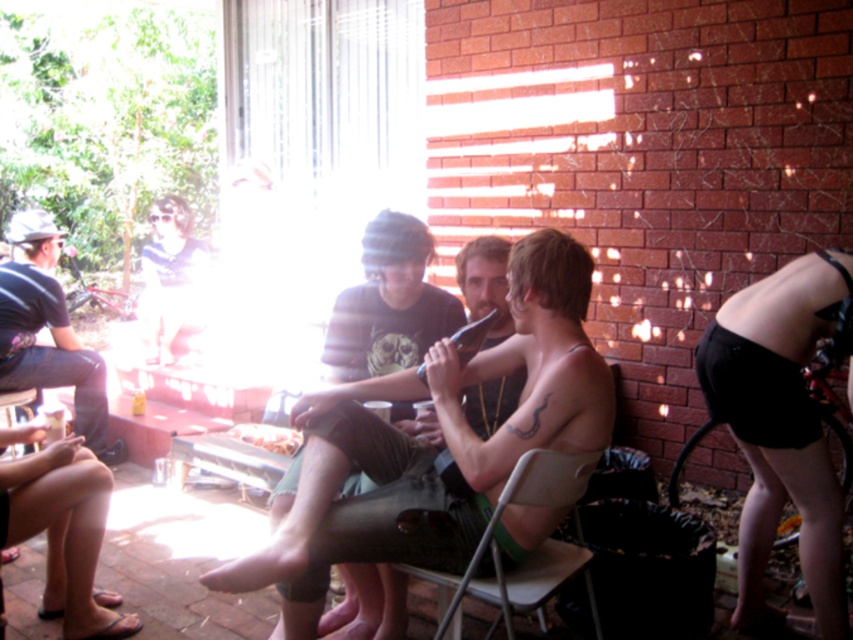
Is point (363, 522) behind point (579, 468)?

Yes, it is.

Does shiny metallic flute at center appear under white plastic chair at lower center?

Actually, shiny metallic flute at center is above white plastic chair at lower center.

Where is `shiny metallic flute at center`? The height and width of the screenshot is (640, 853). shiny metallic flute at center is located at coordinates (430, 449).

The image size is (853, 640). What are the coordinates of `shiny metallic flute at center` in the screenshot? It's located at (430, 449).

Which is in front, point (535, 474) or point (154, 211)?

Point (535, 474) is more forward.

Which is below, white plastic chair at lower center or matte blue shirt at upper left?

white plastic chair at lower center is lower down.

Which is behind, point (500, 570) or point (181, 301)?

Point (181, 301)

Find the location of a particular element. white plastic chair at lower center is located at coordinates (529, 554).

Based on the photo, who is lower down, black fabric shorts at right or dark blue jeans at left?

black fabric shorts at right is below.

Is black fabric shorts at right bigger than dark blue jeans at left?

No.

What do you see at coordinates (781, 428) in the screenshot? The width and height of the screenshot is (853, 640). I see `black fabric shorts at right` at bounding box center [781, 428].

You are a GUI agent. You are given a task and a screenshot of the screen. Output one action in this format:
    pyautogui.click(x=<x>, y=<y>)
    Task: Click on the black fabric shorts at right
    
    Given the screenshot: What is the action you would take?
    pyautogui.click(x=781, y=428)